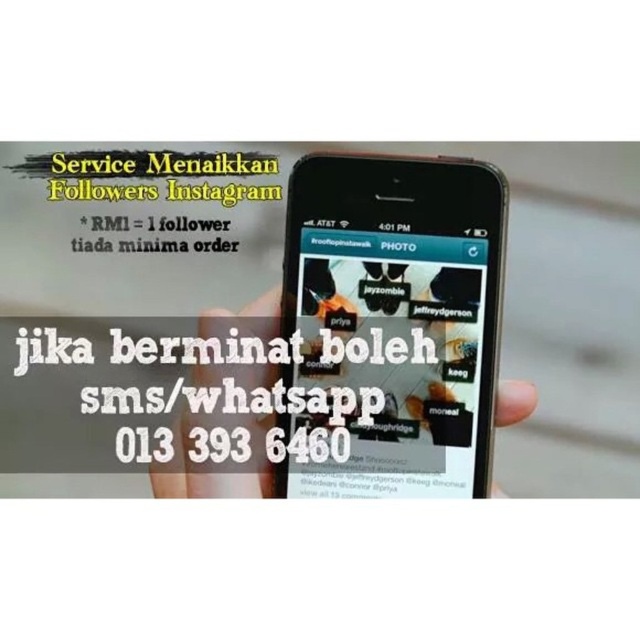
Question: Observing the image, what is the correct spatial positioning of black matte phone at center in reference to white paper at center?

Choices:
 (A) right
 (B) left

Answer: (A)

Question: Does black matte phone at center have a lesser width compared to white paper at center?

Choices:
 (A) no
 (B) yes

Answer: (B)

Question: Among these objects, which one is nearest to the camera?

Choices:
 (A) black matte phone at center
 (B) white paper at center

Answer: (B)

Question: Which point is closer to the camera?

Choices:
 (A) white paper at center
 (B) black matte phone at center

Answer: (A)

Question: Can you confirm if black matte phone at center is bigger than white paper at center?

Choices:
 (A) no
 (B) yes

Answer: (A)

Question: Which point is closer to the camera?

Choices:
 (A) white paper at center
 (B) black matte phone at center

Answer: (A)